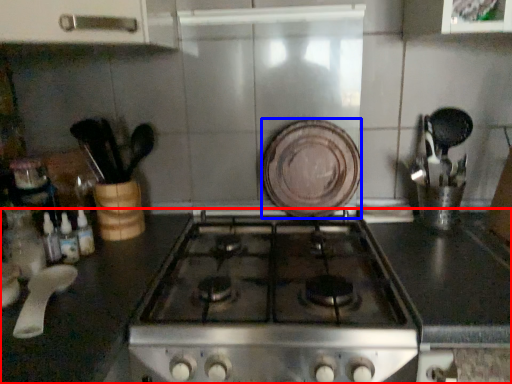
Question: Among these objects, which one is nearest to the camera, countertop (highlighted by a red box) or plate (highlighted by a blue box)?

Choices:
 (A) countertop
 (B) plate

Answer: (A)